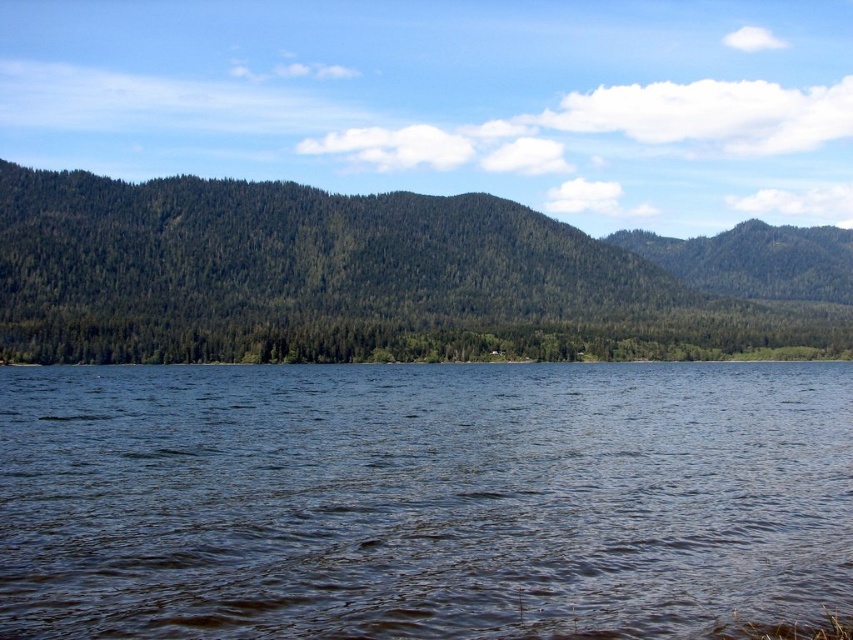
Question: Among these objects, which one is farthest from the camera?

Choices:
 (A) dark blue water at center
 (B) green textured forest at center

Answer: (B)

Question: Which object appears farthest from the camera in this image?

Choices:
 (A) green textured forest at center
 (B) dark blue water at center

Answer: (A)

Question: Does dark blue water at center appear on the right side of green textured forest at center?

Choices:
 (A) no
 (B) yes

Answer: (A)

Question: Is dark blue water at center smaller than green textured forest at center?

Choices:
 (A) no
 (B) yes

Answer: (B)

Question: Can you confirm if dark blue water at center is bigger than green textured forest at center?

Choices:
 (A) no
 (B) yes

Answer: (A)